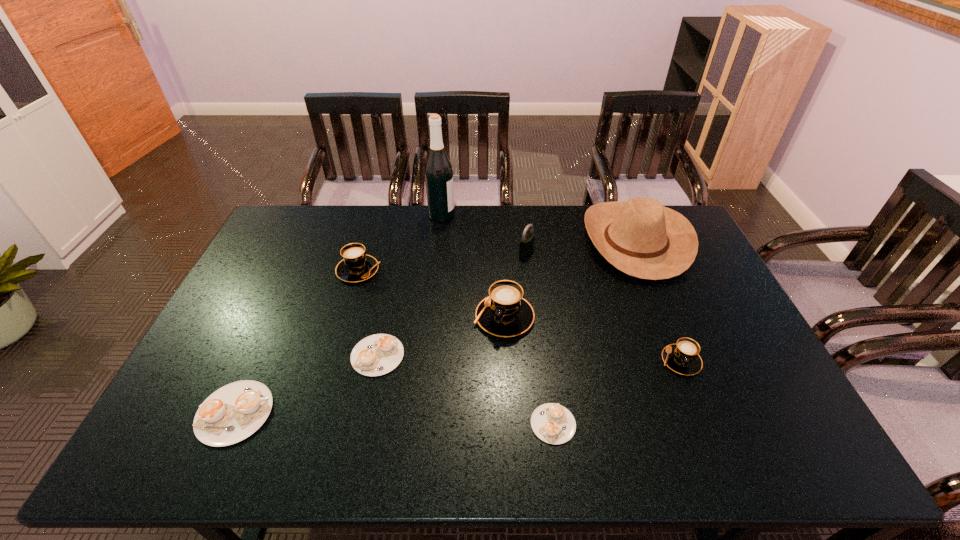
Locate an element on the screen. The height and width of the screenshot is (540, 960). the rightmost cappuccino is located at coordinates (683, 358).

Where is `the leftmost white cappuccino`? This screenshot has height=540, width=960. the leftmost white cappuccino is located at coordinates tap(232, 413).

Locate an element on the screen. the leftmost object is located at coordinates (232, 413).

The image size is (960, 540). I want to click on the fifth tallest cappuccino, so click(375, 355).

Locate an element on the screen. the second smallest white cappuccino is located at coordinates (375, 355).

The width and height of the screenshot is (960, 540). I want to click on the shortest cappuccino, so click(x=553, y=423).

Image resolution: width=960 pixels, height=540 pixels. What are the coordinates of `the rightmost white cappuccino` in the screenshot? It's located at (553, 423).

Locate an element on the screen. Image resolution: width=960 pixels, height=540 pixels. blank space located on the label of the tallest object is located at coordinates (478, 215).

Image resolution: width=960 pixels, height=540 pixels. I want to click on free space located 0.170m on the front-facing side of the brown cowboy hat, so click(536, 241).

In order to click on free space located on the front-facing side of the brown cowboy hat in this screenshot , I will do `click(489, 241)`.